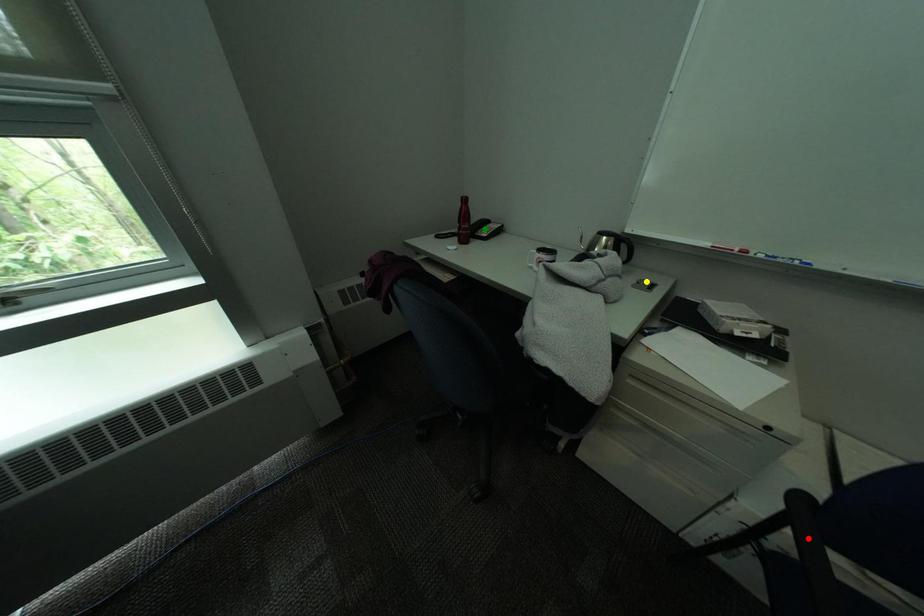
Order these from farthest to nearest:
red point, yellow point, green point

green point
yellow point
red point